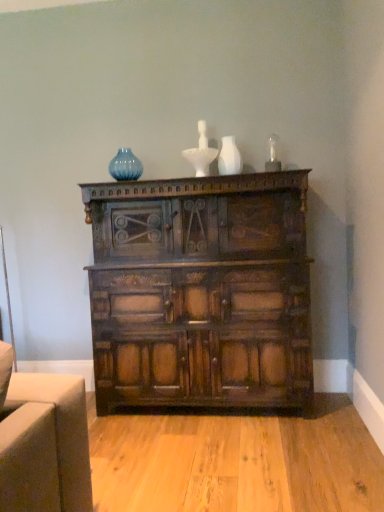
I want to click on dark brown wood chest of drawers at center, so click(201, 291).

Where is `dark brown wood chest of drawers at center`? Image resolution: width=384 pixels, height=512 pixels. dark brown wood chest of drawers at center is located at coordinates (201, 291).

Is dark brown wood chest of drawers at center positioned in front of white matte vase at upper center?

Yes.

Considering the positions of points (137, 329) and (230, 165), is point (137, 329) farther from camera compared to point (230, 165)?

No.

From the image's perspective, is dark brown wood chest of drawers at center on top of white matte vase at upper center?

Actually, dark brown wood chest of drawers at center appears below white matte vase at upper center in the image.

Which of these two, dark brown wood chest of drawers at center or white matte vase at upper center, stands shorter?

white matte vase at upper center is shorter.

Is blue glass vase at upper center shorter than dark brown wood chest of drawers at center?

Yes, blue glass vase at upper center is shorter than dark brown wood chest of drawers at center.

From a real-world perspective, which is physically below, blue glass vase at upper center or dark brown wood chest of drawers at center?

dark brown wood chest of drawers at center.

From the image's perspective, which one is positioned higher, blue glass vase at upper center or dark brown wood chest of drawers at center?

blue glass vase at upper center appears higher in the image.

Does blue glass vase at upper center turn towards dark brown wood chest of drawers at center?

No, blue glass vase at upper center is not facing towards dark brown wood chest of drawers at center.

Is dark brown wood chest of drawers at center wider than blue glass vase at upper center?

Yes.

How many degrees apart are the facing directions of dark brown wood chest of drawers at center and blue glass vase at upper center?

The angle between the facing direction of dark brown wood chest of drawers at center and the facing direction of blue glass vase at upper center is 0.315 degrees.

Which point is more forward, (x=171, y=401) or (x=131, y=164)?

Positioned in front is point (x=171, y=401).

Is dark brown wood chest of drawers at center far from blue glass vase at upper center?

No.

Considering the sizes of objects white matte vase at upper center and dark brown wood chest of drawers at center in the image provided, who is shorter, white matte vase at upper center or dark brown wood chest of drawers at center?

With less height is white matte vase at upper center.

Is white matte vase at upper center positioned with its back to dark brown wood chest of drawers at center?

No, white matte vase at upper center is not facing the opposite direction of dark brown wood chest of drawers at center.

Would you say white matte vase at upper center contains dark brown wood chest of drawers at center?

That's incorrect, dark brown wood chest of drawers at center is not inside white matte vase at upper center.

From the image's perspective, relative to dark brown wood chest of drawers at center, is white matte vase at upper center above or below?

Based on their image positions, white matte vase at upper center is located above dark brown wood chest of drawers at center.

Considering the relative sizes of blue glass vase at upper center and white matte vase at upper center in the image provided, is blue glass vase at upper center smaller than white matte vase at upper center?

No, blue glass vase at upper center is not smaller than white matte vase at upper center.

Considering their positions, is blue glass vase at upper center located in front of or behind white matte vase at upper center?

blue glass vase at upper center is behind white matte vase at upper center.

Does blue glass vase at upper center have a greater height compared to white matte vase at upper center?

In fact, blue glass vase at upper center may be shorter than white matte vase at upper center.

Which of these two, blue glass vase at upper center or white matte vase at upper center, is thinner?

Thinner between the two is blue glass vase at upper center.

Between white matte vase at upper center and blue glass vase at upper center, which one has larger size?

With larger size is blue glass vase at upper center.

Is white matte vase at upper center at the left side of blue glass vase at upper center?

No.

From a real-world perspective, who is located lower, white matte vase at upper center or blue glass vase at upper center?

From a 3D spatial view, white matte vase at upper center is below.

Is white matte vase at upper center situated inside blue glass vase at upper center or outside?

white matte vase at upper center exists outside the volume of blue glass vase at upper center.

This screenshot has height=512, width=384. Find the location of `vase above the dark brown wood chest of drawers at center (from a real-world perspective)`. vase above the dark brown wood chest of drawers at center (from a real-world perspective) is located at coordinates (229, 157).

The image size is (384, 512). Identify the location of glass vase behind the dark brown wood chest of drawers at center. (125, 166).

When comparing their distances from dark brown wood chest of drawers at center, does white matte vase at upper center or blue glass vase at upper center seem further?

blue glass vase at upper center lies further to dark brown wood chest of drawers at center than the other object.

Which object lies further to the anchor point white matte vase at upper center, dark brown wood chest of drawers at center or blue glass vase at upper center?

dark brown wood chest of drawers at center.

Looking at the image, which one is located closer to white matte vase at upper center, blue glass vase at upper center or dark brown wood chest of drawers at center?

The object closer to white matte vase at upper center is blue glass vase at upper center.

Considering their positions, is white matte vase at upper center positioned closer to blue glass vase at upper center than dark brown wood chest of drawers at center?

The object closer to blue glass vase at upper center is white matte vase at upper center.

When comparing their distances from dark brown wood chest of drawers at center, does blue glass vase at upper center or white matte vase at upper center seem further?

Among the two, blue glass vase at upper center is located further to dark brown wood chest of drawers at center.

Based on their spatial positions, is dark brown wood chest of drawers at center or white matte vase at upper center further from blue glass vase at upper center?

Based on the image, dark brown wood chest of drawers at center appears to be further to blue glass vase at upper center.

Find the location of a particular element. This screenshot has height=512, width=384. vase between blue glass vase at upper center and dark brown wood chest of drawers at center vertically is located at coordinates (229, 157).